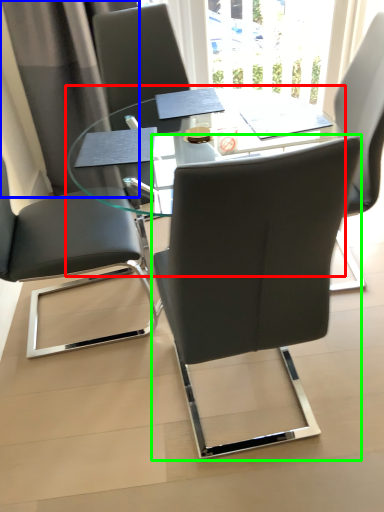
Question: Which is farther away from table (highlighted by a red box)? curtain (highlighted by a blue box) or chair (highlighted by a green box)?

Choices:
 (A) curtain
 (B) chair

Answer: (B)